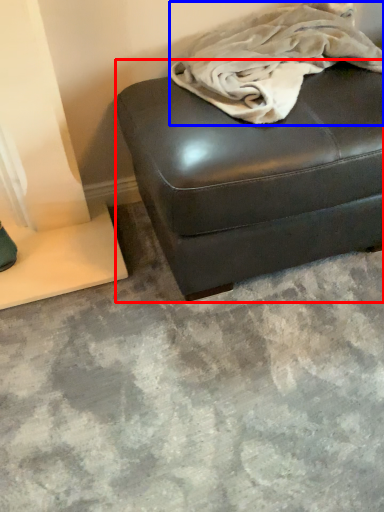
Question: Among these objects, which one is nearest to the camera, furniture (highlighted by a red box) or blanket (highlighted by a blue box)?

Choices:
 (A) furniture
 (B) blanket

Answer: (B)